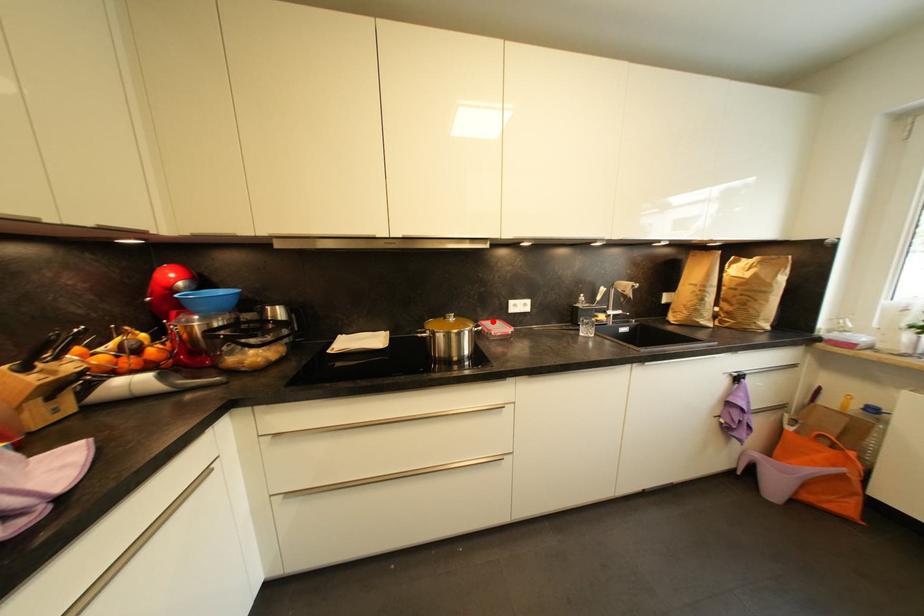
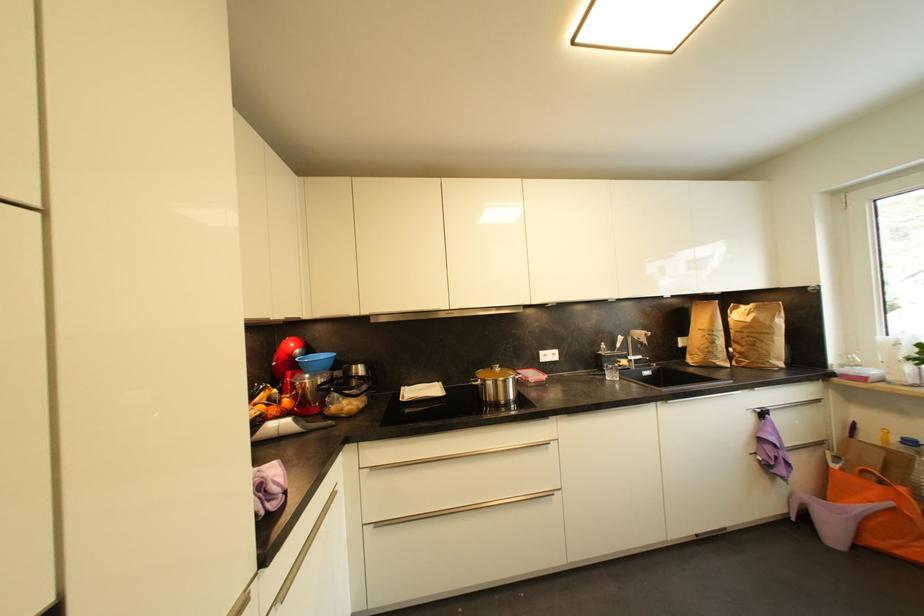
Question: A red point is marked in image1. In image2, is the corresponding 3D point closer to the camera or farther? Reply with the corresponding letter.

Choices:
 (A) The corresponding 3D point is closer.
 (B) The corresponding 3D point is farther.

Answer: (B)